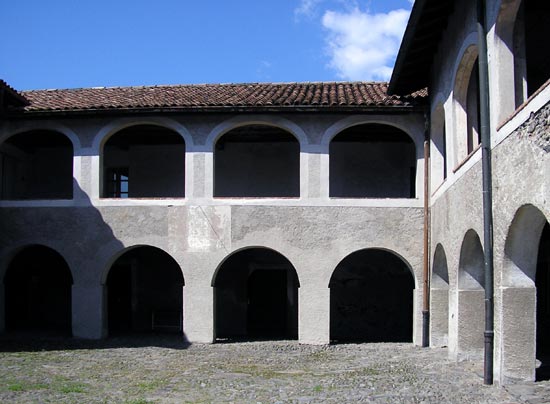
Locate an element on the screen. The height and width of the screenshot is (404, 550). white wall is located at coordinates (200, 231).